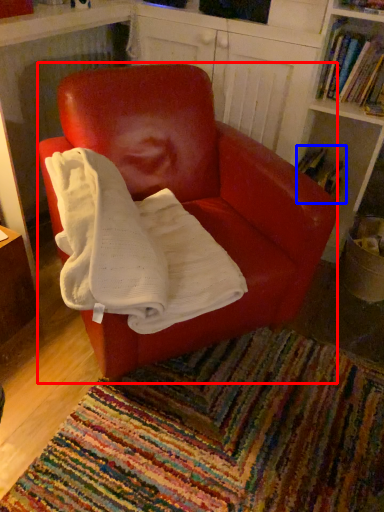
Question: Which of the following is the farthest to the observer, chair (highlighted by a red box) or book (highlighted by a blue box)?

Choices:
 (A) chair
 (B) book

Answer: (B)